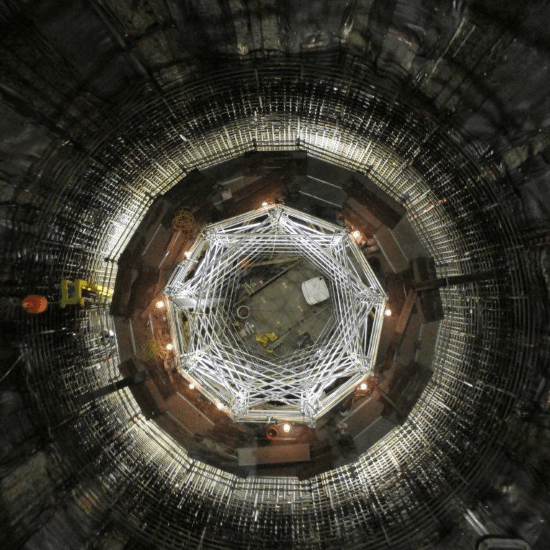
Locate an element on the screen. lights is located at coordinates (155, 302), (263, 204), (356, 234), (390, 309), (363, 387), (285, 429), (190, 385), (221, 405), (168, 345).